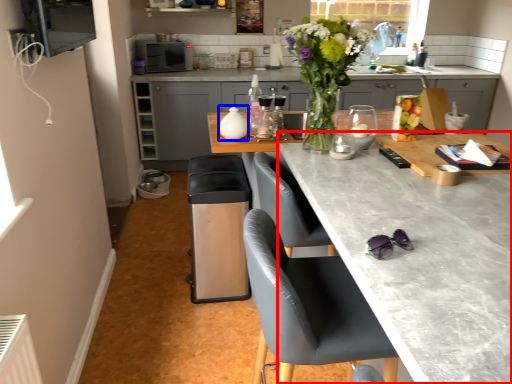
Question: Which object is closer to the camera taking this photo, countertop (highlighted by a red box) or appliance (highlighted by a blue box)?

Choices:
 (A) countertop
 (B) appliance

Answer: (A)